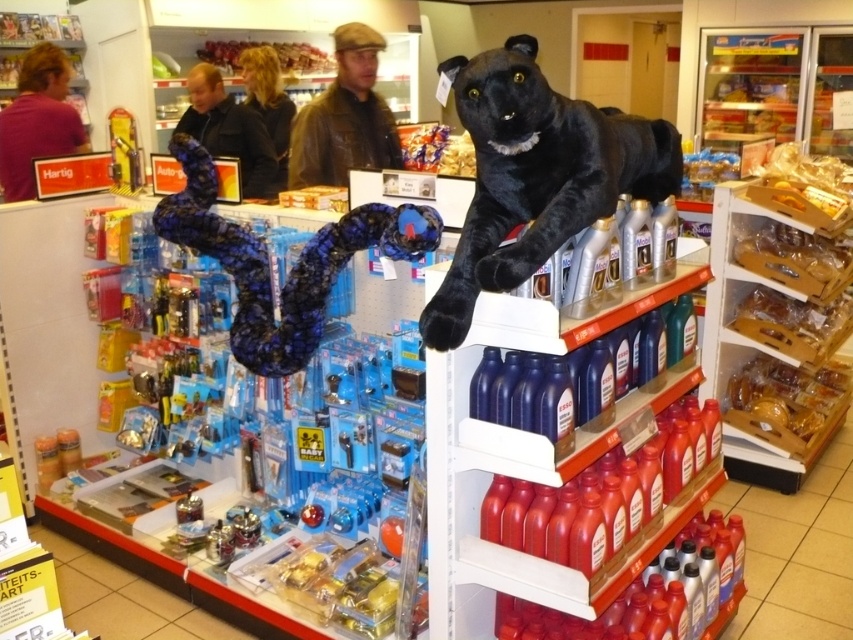
You are a customer looking to purchase a gift for a friend. You see the black plush toy at upper center and the matte pink shirt at left. Which item is shorter in height?

The black plush toy at upper center has a lesser height compared to the matte pink shirt at left, so the black plush toy at upper center is shorter in height.

You are a customer in the store and want to place both the black plush toy at upper center and the blue fabric snake at center into a shopping bag. Which item will require a larger bag in terms of width?

The blue fabric snake at center requires a larger bag in terms of width because it is thicker than the black plush toy at upper center.

You are a customer in the store and want to reach both the black plush toy at upper center and the blue fabric snake at center. Which item should you reach for first if you want to pick up the lower one first?

The blue fabric snake at center is lower than the black plush toy at upper center, so you should reach for the blue fabric snake at center first.